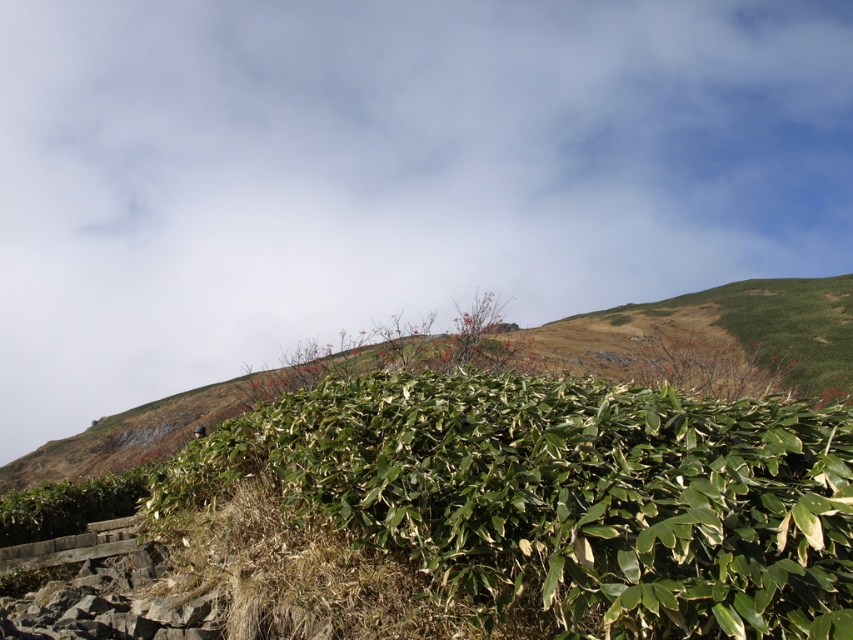
Who is higher up, white fluffy cloud at upper center or green leafy bush at center?

Positioned higher is white fluffy cloud at upper center.

Is point (531, 67) more distant than point (804, 451)?

Yes, point (531, 67) is farther from viewer.

The height and width of the screenshot is (640, 853). Find the location of `white fluffy cloud at upper center`. white fluffy cloud at upper center is located at coordinates (387, 173).